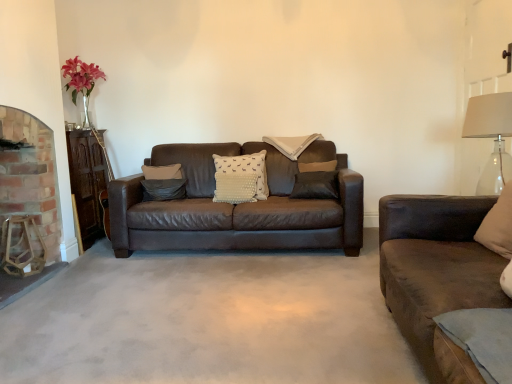
Question: Does suede pillow at center, arranged as the second pillow when viewed from the back, have a greater height compared to brick fireplace at left?

Choices:
 (A) yes
 (B) no

Answer: (B)

Question: Is suede pillow at center, the 3th pillow when ordered from front to back, facing towards brick fireplace at left?

Choices:
 (A) yes
 (B) no

Answer: (B)

Question: Is suede pillow at center, the first pillow viewed from the left, in contact with brick fireplace at left?

Choices:
 (A) yes
 (B) no

Answer: (B)

Question: Does suede pillow at center, arranged as the second pillow when viewed from the back, have a larger size compared to brick fireplace at left?

Choices:
 (A) no
 (B) yes

Answer: (A)

Question: Choose the correct answer: Is brick fireplace at left inside clear glass lampshade at right or outside it?

Choices:
 (A) outside
 (B) inside

Answer: (A)

Question: Considering the relative positions of brick fireplace at left and clear glass lampshade at right in the image provided, is brick fireplace at left to the left or to the right of clear glass lampshade at right?

Choices:
 (A) right
 (B) left

Answer: (B)

Question: Is brick fireplace at left wider or thinner than clear glass lampshade at right?

Choices:
 (A) wide
 (B) thin

Answer: (B)

Question: From a real-world perspective, is brick fireplace at left above or below clear glass lampshade at right?

Choices:
 (A) below
 (B) above

Answer: (A)

Question: From a real-world perspective, is white dotted fabric pillow at center, which is the 2th pillow in left-to-right order, physically located above or below suede pillow at center, arranged as the second pillow when viewed from the back?

Choices:
 (A) below
 (B) above

Answer: (B)

Question: In the image, is white dotted fabric pillow at center, which appears as the second pillow when viewed from the front, on the left side or the right side of suede pillow at center, the 3th pillow when ordered from front to back?

Choices:
 (A) left
 (B) right

Answer: (B)

Question: Is white dotted fabric pillow at center, which is counted as the 3th pillow, starting from the back, bigger or smaller than suede pillow at center, the first pillow viewed from the left?

Choices:
 (A) small
 (B) big

Answer: (B)

Question: Considering the positions of white dotted fabric pillow at center, which is the 2th pillow in left-to-right order, and suede pillow at center, arranged as the second pillow when viewed from the back, in the image, is white dotted fabric pillow at center, which is the 2th pillow in left-to-right order, taller or shorter than suede pillow at center, arranged as the second pillow when viewed from the back,?

Choices:
 (A) short
 (B) tall

Answer: (B)

Question: In terms of size, does suede pillow at center, the 3th pillow when ordered from front to back, appear bigger or smaller than clear glass lampshade at right?

Choices:
 (A) small
 (B) big

Answer: (A)

Question: Would you say suede pillow at center, arranged as the second pillow when viewed from the back, is inside or outside clear glass lampshade at right?

Choices:
 (A) outside
 (B) inside

Answer: (A)